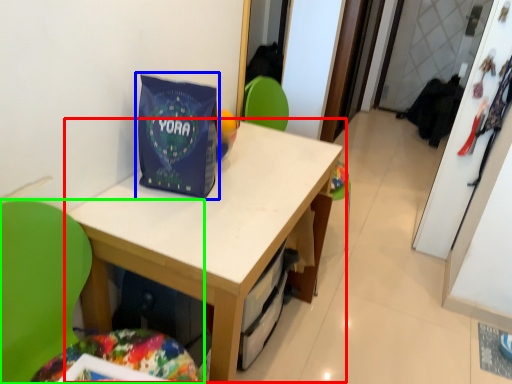
Question: Which object is positioned farthest from table (highlighted by a red box)? Select from gift bag (highlighted by a blue box) and chair (highlighted by a green box).

Choices:
 (A) gift bag
 (B) chair

Answer: (B)